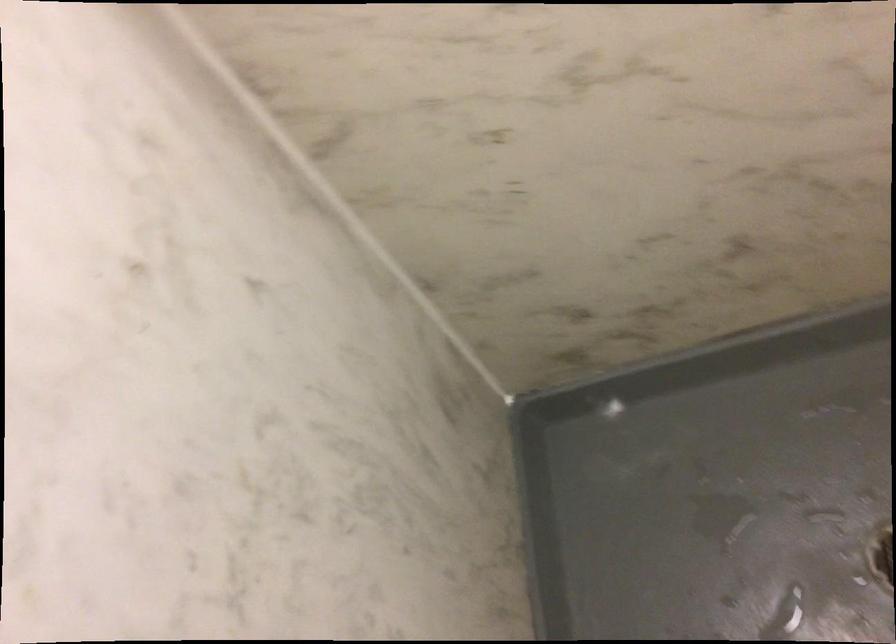
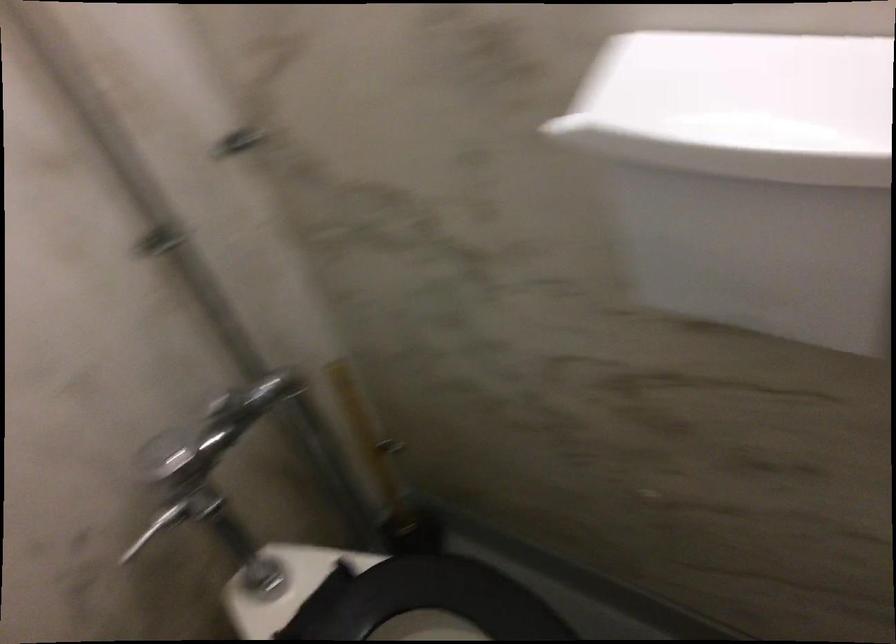
Question: The camera is either moving clockwise (left) or counter-clockwise (right) around the object. The first image is from the beginning of the video and the second image is from the end. Is the camera moving left or right when shooting the video?

Choices:
 (A) Left
 (B) Right

Answer: (A)